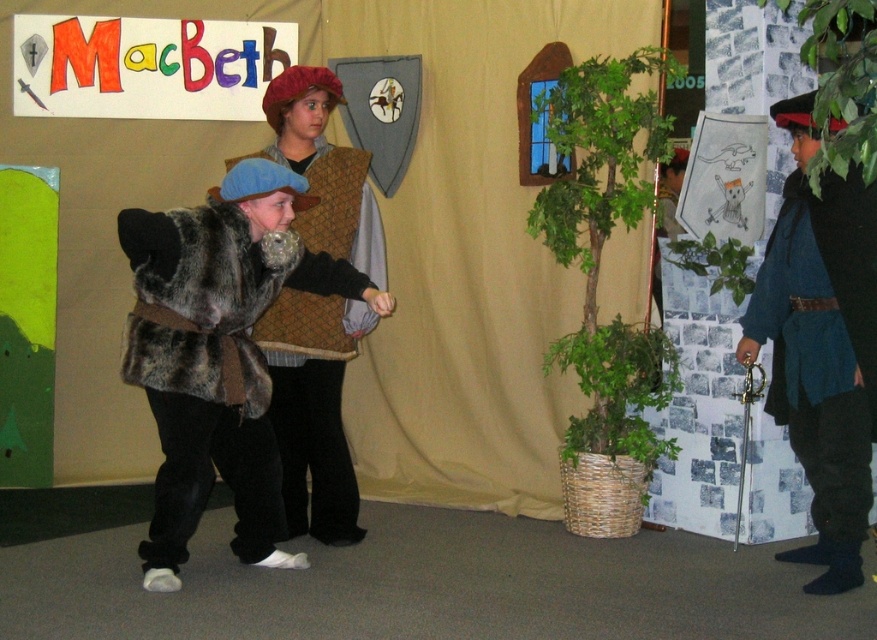
Who is more distant from viewer, (811,429) or (182,349)?

The point (811,429) is behind.

Who is higher up, blue woolen tunic at right or fuzzy brown fur vest at center?

fuzzy brown fur vest at center is higher up.

Describe the element at coordinates (821, 344) in the screenshot. Image resolution: width=877 pixels, height=640 pixels. I see `blue woolen tunic at right` at that location.

This screenshot has height=640, width=877. Find the location of `blue woolen tunic at right`. blue woolen tunic at right is located at coordinates (821, 344).

Does fur vest at center have a lesser height compared to fuzzy brown fur vest at center?

No, fur vest at center is not shorter than fuzzy brown fur vest at center.

Is fur vest at center above fuzzy brown fur vest at center?

Incorrect, fur vest at center is not positioned above fuzzy brown fur vest at center.

I want to click on fur vest at center, so 312,406.

At what (x,y) coordinates should I click in order to perform the action: click on fur vest at center. Please return your answer as a coordinate pair (x, y). This screenshot has width=877, height=640. Looking at the image, I should click on (312, 406).

Which is below, blue woolen tunic at right or fur vest at center?

blue woolen tunic at right is lower down.

Which is in front, point (761, 307) or point (318, 193)?

Point (761, 307) is more forward.

Which is behind, point (811, 586) or point (353, 221)?

The point (353, 221) is behind.

The height and width of the screenshot is (640, 877). Find the location of `blue woolen tunic at right`. blue woolen tunic at right is located at coordinates (821, 344).